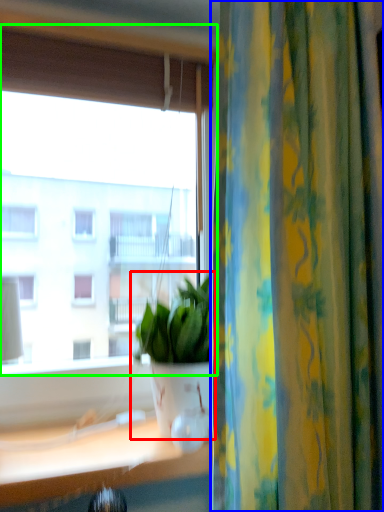
Question: Which object is positioned closest to houseplant (highlighted by a red box)? Select from curtain (highlighted by a blue box) and window (highlighted by a green box).

Choices:
 (A) curtain
 (B) window

Answer: (A)